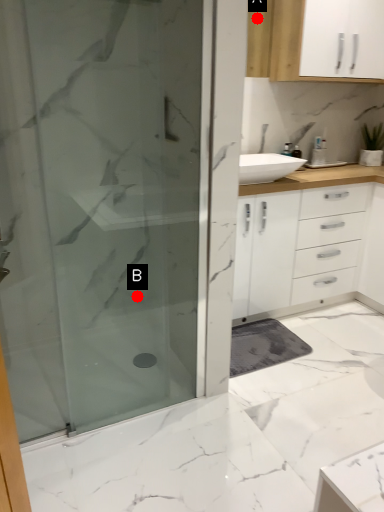
Question: Two points are circled on the image, labeled by A and B beside each circle. Among these points, which one is farthest from the camera?

Choices:
 (A) A is further
 (B) B is further

Answer: (B)